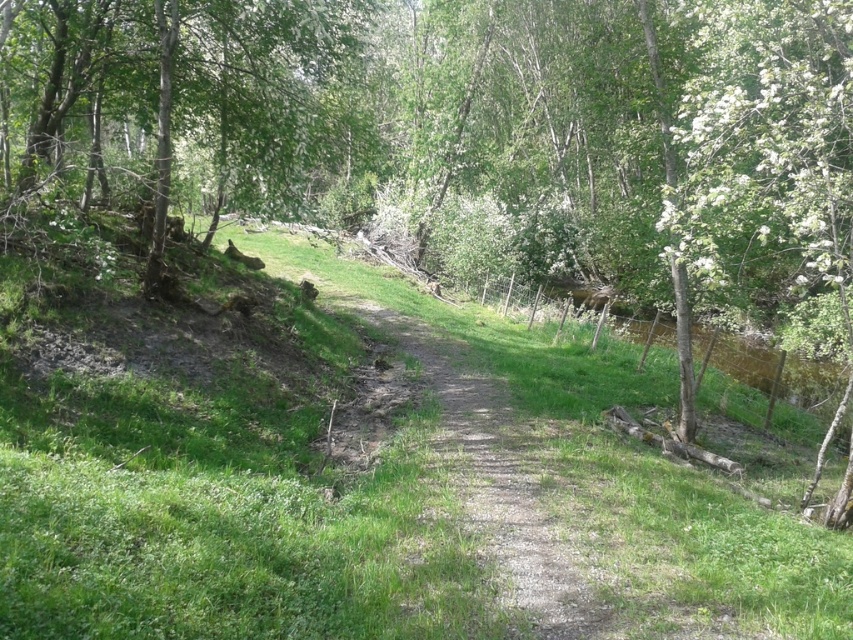
Question: Is green grassy at center bigger than green leafy tree at upper left?

Choices:
 (A) yes
 (B) no

Answer: (B)

Question: Can you confirm if green grassy at center is thinner than dirt/gravel path at center?

Choices:
 (A) no
 (B) yes

Answer: (A)

Question: Which of the following is the farthest from the observer?

Choices:
 (A) (24, 13)
 (B) (393, 436)
 (C) (517, 563)

Answer: (B)

Question: Is green leafy tree at upper left below dirt/gravel path at center?

Choices:
 (A) yes
 (B) no

Answer: (B)

Question: Among these objects, which one is nearest to the camera?

Choices:
 (A) dirt/gravel path at center
 (B) green leafy tree at upper left
 (C) green grassy at center

Answer: (C)

Question: Which point is closer to the camera?

Choices:
 (A) green leafy tree at upper left
 (B) green grassy at center
 (C) dirt/gravel path at center

Answer: (B)